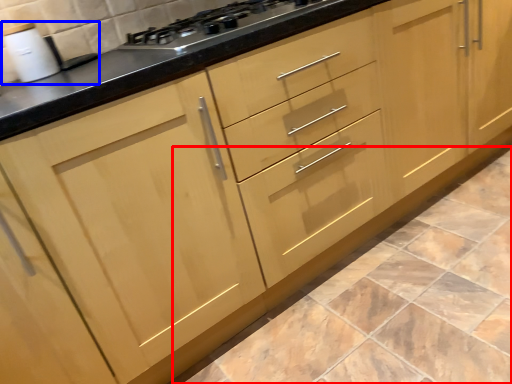
Question: Which point is closer to the camera, ceramic tile (highlighted by a red box) or sink (highlighted by a blue box)?

Choices:
 (A) ceramic tile
 (B) sink

Answer: (A)